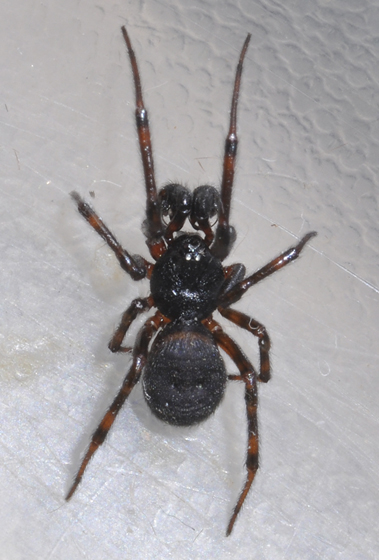
Find the location of a particular element. Image resolution: width=379 pixels, height=560 pixels. wall is located at coordinates (318, 172).